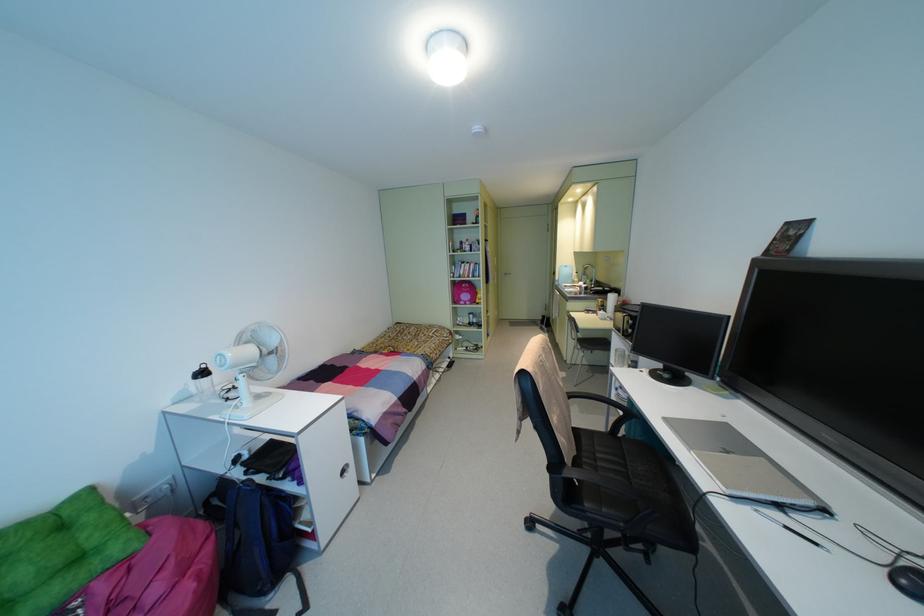
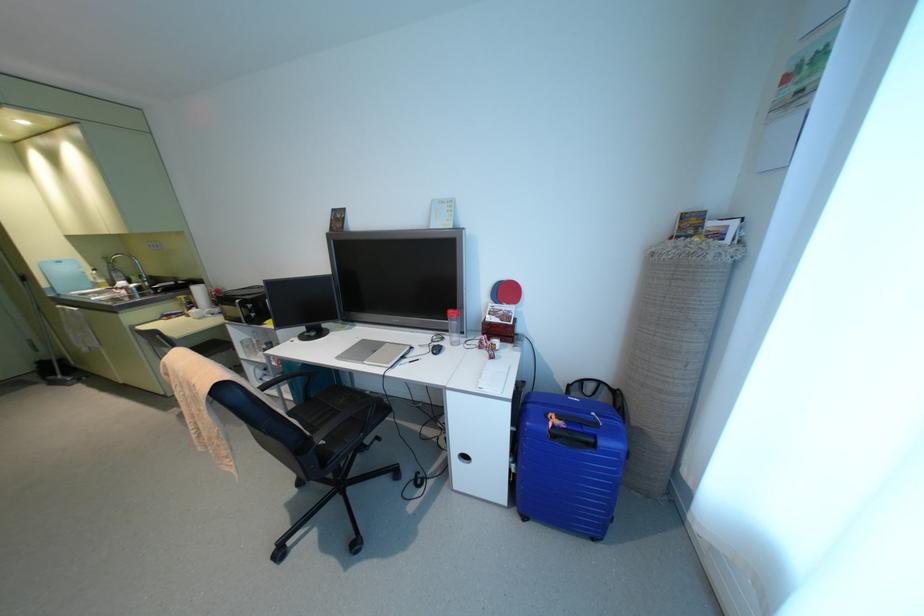
Question: I am providing you with two images of the same scene from different viewpoints. Which of the following objects are not visible in image2?

Choices:
 (A) blue suitcase handle
 (B) red ping-pong paddle
 (C) white mug
 (D) none of these

Answer: (D)